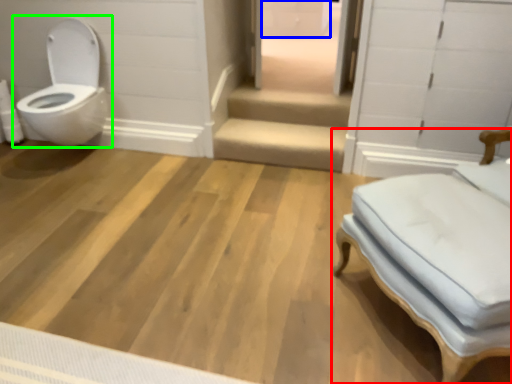
Question: Which is nearer to the furniture (highlighted by a red box)? drawer (highlighted by a blue box) or toilet (highlighted by a green box).

Choices:
 (A) drawer
 (B) toilet

Answer: (B)